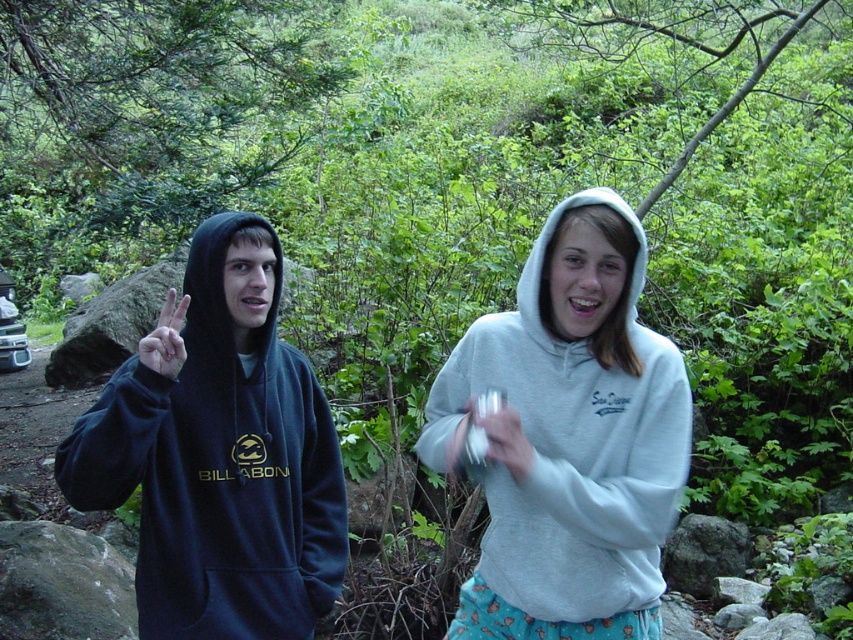
Does dark blue hoodie at center have a greater height compared to matte black hand at center?

Yes.

Can you confirm if dark blue hoodie at center is positioned to the right of matte black hand at center?

Indeed, dark blue hoodie at center is positioned on the right side of matte black hand at center.

The width and height of the screenshot is (853, 640). I want to click on dark blue hoodie at center, so click(x=572, y=436).

Can you confirm if matte black hand at center is taller than white matte hand at center?

Yes, matte black hand at center is taller than white matte hand at center.

Can you confirm if matte black hand at center is positioned to the right of white matte hand at center?

In fact, matte black hand at center is to the left of white matte hand at center.

Locate an element on the screen. Image resolution: width=853 pixels, height=640 pixels. matte black hand at center is located at coordinates (166, 339).

Can you confirm if dark blue fleece hoodie at left is thinner than matte black hand at center?

Correct, dark blue fleece hoodie at left's width is less than matte black hand at center's.

Describe the element at coordinates (221, 458) in the screenshot. I see `dark blue fleece hoodie at left` at that location.

Find the location of `dark blue fleece hoodie at left`. dark blue fleece hoodie at left is located at coordinates (221, 458).